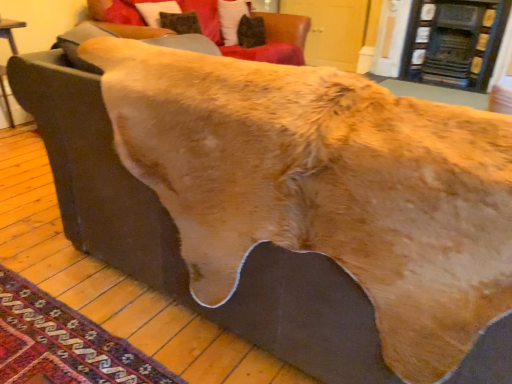
The image size is (512, 384). I want to click on carpeted rug at lower left, so click(x=64, y=342).

Image resolution: width=512 pixels, height=384 pixels. What do you see at coordinates (265, 34) in the screenshot?
I see `fur-like fabric at upper center` at bounding box center [265, 34].

Locate an element on the screen. This screenshot has width=512, height=384. carpeted rug at lower left is located at coordinates (64, 342).

In the scene shown: From the image's perspective, between velvet dark brown pillow at upper center and carpeted rug at lower left, who is located below?

carpeted rug at lower left appears lower in the image.

Consider the image. Is velvet dark brown pillow at upper center directly adjacent to carpeted rug at lower left?

velvet dark brown pillow at upper center and carpeted rug at lower left are not in contact.

Considering the relative sizes of velvet dark brown pillow at upper center and carpeted rug at lower left in the image provided, is velvet dark brown pillow at upper center shorter than carpeted rug at lower left?

No.

Considering the points (233, 9) and (42, 293), which point is in front, point (233, 9) or point (42, 293)?

The point (42, 293) is in front.

Can you confirm if fur-like fabric at upper center is shorter than velvet dark brown pillow at upper center?

No, fur-like fabric at upper center is not shorter than velvet dark brown pillow at upper center.

How different are the orientations of fur-like fabric at upper center and velvet dark brown pillow at upper center in degrees?

fur-like fabric at upper center and velvet dark brown pillow at upper center are facing 0.000342 degrees away from each other.

Consider the image. Could you tell me if fur-like fabric at upper center is facing velvet dark brown pillow at upper center?

Yes, fur-like fabric at upper center is facing velvet dark brown pillow at upper center.

Which is correct: fur-like fabric at upper center is inside velvet dark brown pillow at upper center, or outside of it?

fur-like fabric at upper center is outside velvet dark brown pillow at upper center.

Is carpeted rug at lower left spatially inside fur-like fabric at upper center, or outside of it?

carpeted rug at lower left lies outside fur-like fabric at upper center.

From the image's perspective, which is below, carpeted rug at lower left or fur-like fabric at upper center?

carpeted rug at lower left, from the image's perspective.

Could you tell me if carpeted rug at lower left is facing fur-like fabric at upper center?

No, carpeted rug at lower left is not facing towards fur-like fabric at upper center.

Which point is more distant from viewer, (21, 331) or (271, 58)?

Positioned behind is point (271, 58).

Can you confirm if fur-like fabric at upper center is smaller than carpeted rug at lower left?

No, fur-like fabric at upper center is not smaller than carpeted rug at lower left.

Which is more to the left, fur-like fabric at upper center or carpeted rug at lower left?

Positioned to the left is carpeted rug at lower left.

From a real-world perspective, between fur-like fabric at upper center and carpeted rug at lower left, who is vertically lower?

carpeted rug at lower left is physically lower.

Who is smaller, velvet dark brown pillow at upper center or fur-like fabric at upper center?

With smaller size is velvet dark brown pillow at upper center.

From a real-world perspective, relative to fur-like fabric at upper center, is velvet dark brown pillow at upper center vertically above or below?

velvet dark brown pillow at upper center is above fur-like fabric at upper center.

What's the angular difference between velvet dark brown pillow at upper center and fur-like fabric at upper center's facing directions?

The facing directions of velvet dark brown pillow at upper center and fur-like fabric at upper center are 0.000342 degrees apart.

At what (x,y) coordinates should I click in order to perform the action: click on pillow that is behind the carpeted rug at lower left. Please return your answer as a coordinate pair (x, y). This screenshot has height=384, width=512. Looking at the image, I should click on (231, 19).

From a real-world perspective, who is located lower, carpeted rug at lower left or velvet dark brown pillow at upper center?

carpeted rug at lower left.

Relative to velvet dark brown pillow at upper center, is carpeted rug at lower left in front or behind?

carpeted rug at lower left is positioned closer to the viewer than velvet dark brown pillow at upper center.

Can you confirm if carpeted rug at lower left is wider than velvet dark brown pillow at upper center?

Indeed, carpeted rug at lower left has a greater width compared to velvet dark brown pillow at upper center.

Find the location of a particular element. mat located below the velvet dark brown pillow at upper center (from the image's perspective) is located at coordinates (64, 342).

The height and width of the screenshot is (384, 512). In order to click on studio couch below the velvet dark brown pillow at upper center (from a real-world perspective) in this screenshot , I will do `click(265, 34)`.

Estimate the real-world distances between objects in this image. Which object is closer to fur-like fabric at upper center, velvet dark brown pillow at upper center or carpeted rug at lower left?

velvet dark brown pillow at upper center is positioned closer to the anchor fur-like fabric at upper center.

Based on their spatial positions, is carpeted rug at lower left or fur-like fabric at upper center closer to velvet dark brown pillow at upper center?

fur-like fabric at upper center is positioned closer to the anchor velvet dark brown pillow at upper center.

When comparing their distances from fur-like fabric at upper center, does carpeted rug at lower left or velvet dark brown pillow at upper center seem further?

carpeted rug at lower left is positioned further to the anchor fur-like fabric at upper center.

Considering their positions, is fur-like fabric at upper center positioned further to velvet dark brown pillow at upper center than carpeted rug at lower left?

Among the two, carpeted rug at lower left is located further to velvet dark brown pillow at upper center.

In the scene shown: Based on their spatial positions, is fur-like fabric at upper center or velvet dark brown pillow at upper center further from carpeted rug at lower left?

velvet dark brown pillow at upper center is further to carpeted rug at lower left.

Estimate the real-world distances between objects in this image. Which object is closer to carpeted rug at lower left, velvet dark brown pillow at upper center or fur-like fabric at upper center?

fur-like fabric at upper center is positioned closer to the anchor carpeted rug at lower left.

Find the location of a particular element. Image resolution: width=512 pixels, height=384 pixels. studio couch positioned between carpeted rug at lower left and velvet dark brown pillow at upper center from near to far is located at coordinates (265, 34).